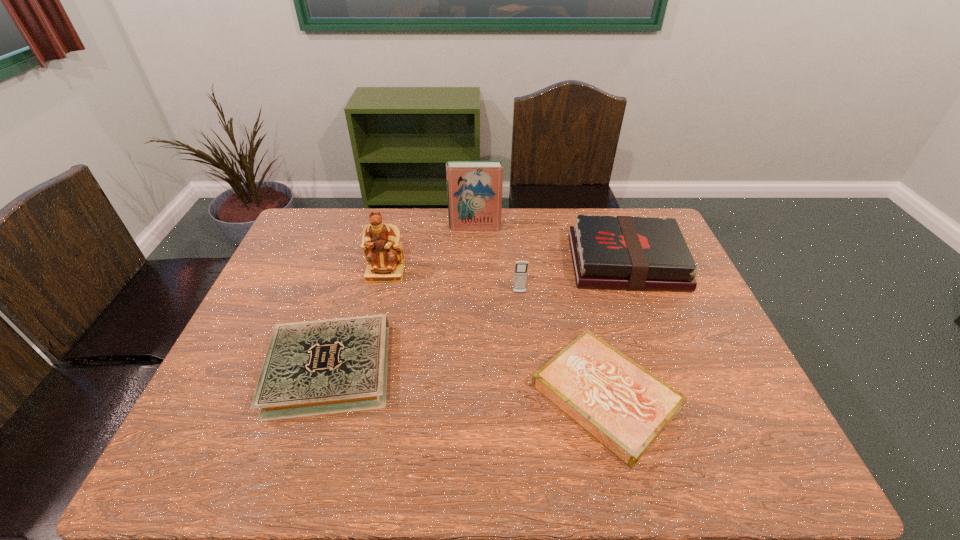
Where is `vacant region located 0.160m on the front-facing side of the cellular telephone`? The height and width of the screenshot is (540, 960). vacant region located 0.160m on the front-facing side of the cellular telephone is located at coordinates (523, 336).

Identify the location of free location located 0.150m on the left of the third shortest hardback book. The width and height of the screenshot is (960, 540). (524, 263).

Identify the location of vacant region located on the back of the leftmost hardback book. (347, 314).

Locate an element on the screen. The image size is (960, 540). blank space located on the left of the shortest hardback book is located at coordinates (412, 396).

This screenshot has height=540, width=960. Identify the location of object that is at the near edge. (625, 407).

The image size is (960, 540). What are the coordinates of `object that is at the left edge` in the screenshot? It's located at (317, 367).

The height and width of the screenshot is (540, 960). Identify the location of object at the right edge. (630, 253).

Identify the location of object that is at the far right corner. (630, 253).

Locate an element on the screen. This screenshot has height=540, width=960. vacant space at the far edge of the desktop is located at coordinates (558, 208).

In the image, there is a desktop. Identify the location of vacant space at the near edge. tap(314, 454).